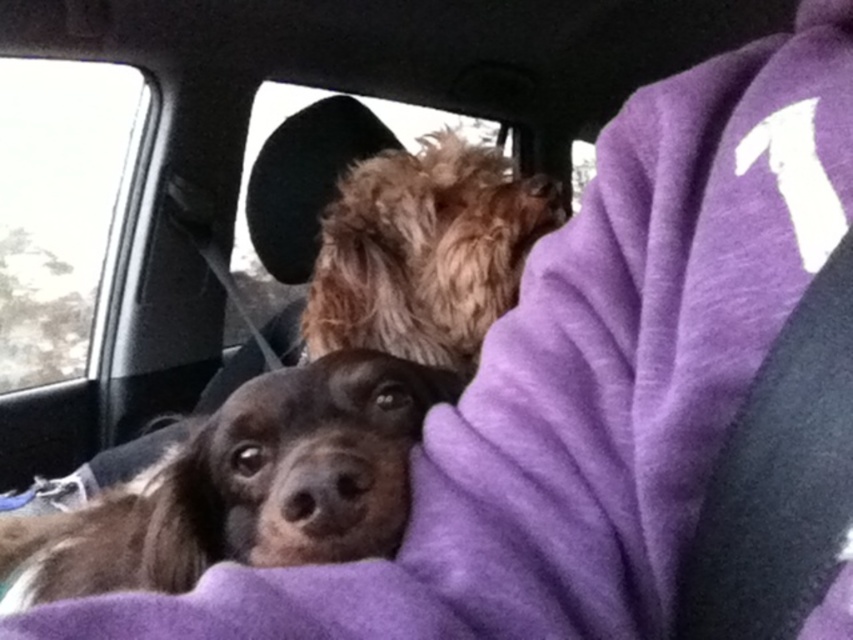
In the scene shown: You are a dog owner who wants to place a 18 inch long toy between the brown fur dog at center and the fuzzy brown dog at upper center. Is there enough space between them to fit the toy?

The distance between the brown fur dog at center and the fuzzy brown dog at upper center is 20.77 inches, so yes, the 18 inch long toy can fit between them since the space is larger than the toy.

You are a passenger in the car and want to know if the brown fur dog at center can fit through the transparent glass at upper left. Can it?

The brown fur dog at center has a smaller size compared to transparent glass at upper left, so it can fit through the transparent glass at upper left.

Based on the photo, you are sitting in the backseat of a car and see two points marked in the scene. The first point is at coordinate point (270, 451) and the second is at point (67, 282). Which point is nearer to you?

Point (270, 451) is closer to the viewer than point (67, 282), so the first point is nearer to you.